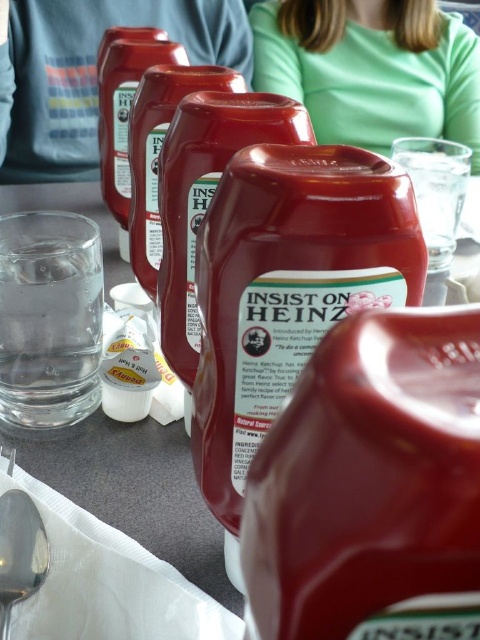
You are standing in front of the table with the Heinz ketchup bottles. There is a green matte shirt at upper center. Where exactly is the green matte shirt positioned relative to the table?

The green matte shirt at upper center is located at point coordinates approximately 0.127 along the horizontal axis and 0.758 along the vertical axis relative to the table.

You are sitting at a table with a matte plastic cup at upper center and a green matte shirt at upper center. Which object is closer to you?

The matte plastic cup at upper center is closer to you because it is in front of the green matte shirt at upper center.